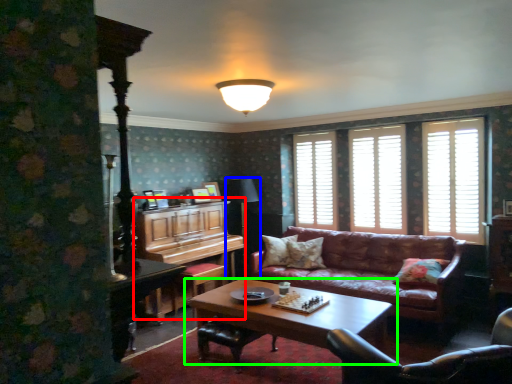
Question: Which object is positioned closest to dresser (highlighted by a red box)? Select from table lamp (highlighted by a blue box) and coffee table (highlighted by a green box).

Choices:
 (A) table lamp
 (B) coffee table

Answer: (A)